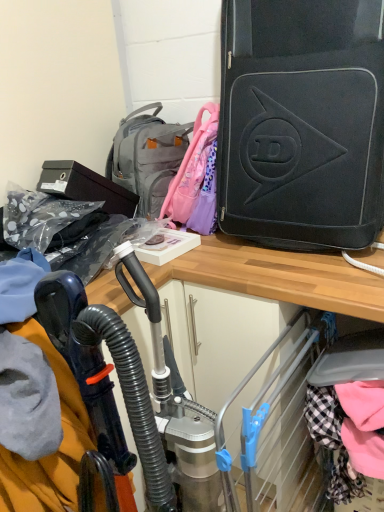
Question: Would you say metallic silver vacuum cleaner at center is outside gray fabric backpack at upper center?

Choices:
 (A) yes
 (B) no

Answer: (A)

Question: From a real-world perspective, is metallic silver vacuum cleaner at center below gray fabric backpack at upper center?

Choices:
 (A) yes
 (B) no

Answer: (A)

Question: From the image's perspective, is metallic silver vacuum cleaner at center located beneath gray fabric backpack at upper center?

Choices:
 (A) no
 (B) yes

Answer: (B)

Question: Could you tell me if metallic silver vacuum cleaner at center is turned towards gray fabric backpack at upper center?

Choices:
 (A) yes
 (B) no

Answer: (B)

Question: Can you confirm if metallic silver vacuum cleaner at center is positioned to the left of gray fabric backpack at upper center?

Choices:
 (A) yes
 (B) no

Answer: (B)

Question: Considering the relative positions of metallic silver vacuum cleaner at center and gray fabric backpack at upper center in the image provided, is metallic silver vacuum cleaner at center to the left or to the right of gray fabric backpack at upper center?

Choices:
 (A) left
 (B) right

Answer: (B)

Question: From their relative heights in the image, would you say metallic silver vacuum cleaner at center is taller or shorter than gray fabric backpack at upper center?

Choices:
 (A) short
 (B) tall

Answer: (B)

Question: Considering their positions, is metallic silver vacuum cleaner at center located in front of or behind gray fabric backpack at upper center?

Choices:
 (A) front
 (B) behind

Answer: (A)

Question: Considering the positions of point (160, 394) and point (150, 166), is point (160, 394) closer or farther from the camera than point (150, 166)?

Choices:
 (A) closer
 (B) farther

Answer: (A)

Question: In terms of width, does gray fabric backpack at upper center look wider or thinner when compared to black matte suitcase at upper right?

Choices:
 (A) thin
 (B) wide

Answer: (A)

Question: In terms of size, does gray fabric backpack at upper center appear bigger or smaller than black matte suitcase at upper right?

Choices:
 (A) small
 (B) big

Answer: (A)

Question: Would you say gray fabric backpack at upper center is inside or outside black matte suitcase at upper right?

Choices:
 (A) outside
 (B) inside

Answer: (A)

Question: In terms of height, does gray fabric backpack at upper center look taller or shorter compared to black matte suitcase at upper right?

Choices:
 (A) short
 (B) tall

Answer: (A)

Question: From the image's perspective, is gray fabric backpack at upper center positioned above or below metallic silver vacuum cleaner at center?

Choices:
 (A) below
 (B) above

Answer: (B)

Question: In terms of size, does gray fabric backpack at upper center appear bigger or smaller than metallic silver vacuum cleaner at center?

Choices:
 (A) small
 (B) big

Answer: (A)